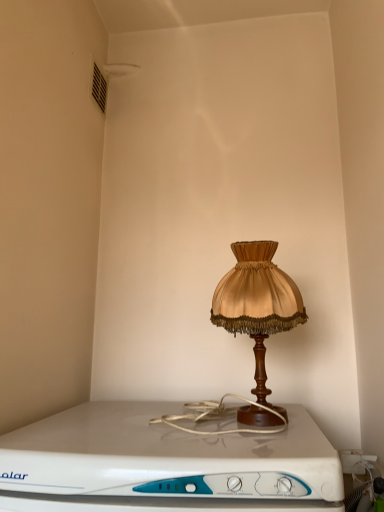
Identify the location of satin gold lampshade at center. The width and height of the screenshot is (384, 512). (258, 317).

Image resolution: width=384 pixels, height=512 pixels. Describe the element at coordinates (258, 317) in the screenshot. I see `satin gold lampshade at center` at that location.

I want to click on satin gold lampshade at center, so click(258, 317).